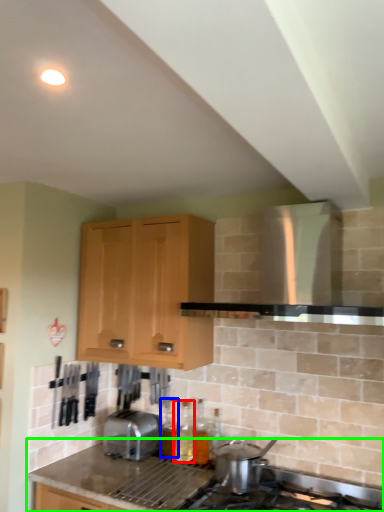
Question: Based on their relative distances, which object is farther from bottle (highlighted by a red box)? Choose from bottle (highlighted by a blue box) and countertop (highlighted by a green box).

Choices:
 (A) bottle
 (B) countertop

Answer: (B)